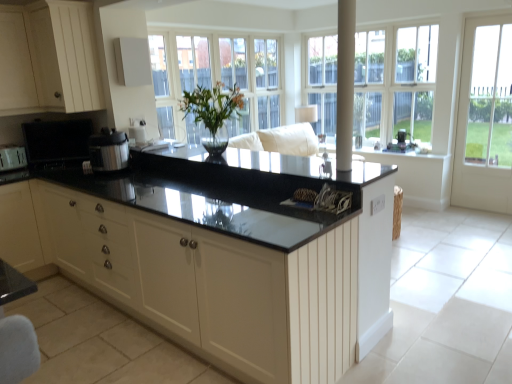
Question: Considering the positions of point (90, 105) and point (211, 173), is point (90, 105) closer or farther from the camera than point (211, 173)?

Choices:
 (A) farther
 (B) closer

Answer: (A)

Question: Considering the positions of white wood cabinet at upper left and black granite countertop at center, the 1th countertop in the top-to-bottom sequence, in the image, is white wood cabinet at upper left wider or thinner than black granite countertop at center, the 1th countertop in the top-to-bottom sequence,?

Choices:
 (A) thin
 (B) wide

Answer: (A)

Question: Which is farther from the metallic silver toaster at left, the 2th appliance from the front?

Choices:
 (A) matte black television at left, the 2th appliance in the back-to-front sequence
 (B) satin black speaker at upper right, positioned as the fourth appliance in front-to-back order
 (C) satin silver pressure cooker at center, the 2th appliance from the right
 (D) white glossy pole at center
 (E) black polished granite countertop at center, which is counted as the 1th countertop, starting from the bottom

Answer: (B)

Question: Based on their relative distances, which object is nearer to the white wood cabinet at upper left?

Choices:
 (A) metallic silver toaster at left, the 2th appliance from the front
 (B) white glass door at right
 (C) black polished granite countertop at center, the 2th countertop when ordered from top to bottom
 (D) matte black television at left, the 2th appliance in the back-to-front sequence
 (E) satin black speaker at upper right, positioned as the first appliance in back-to-front order

Answer: (D)